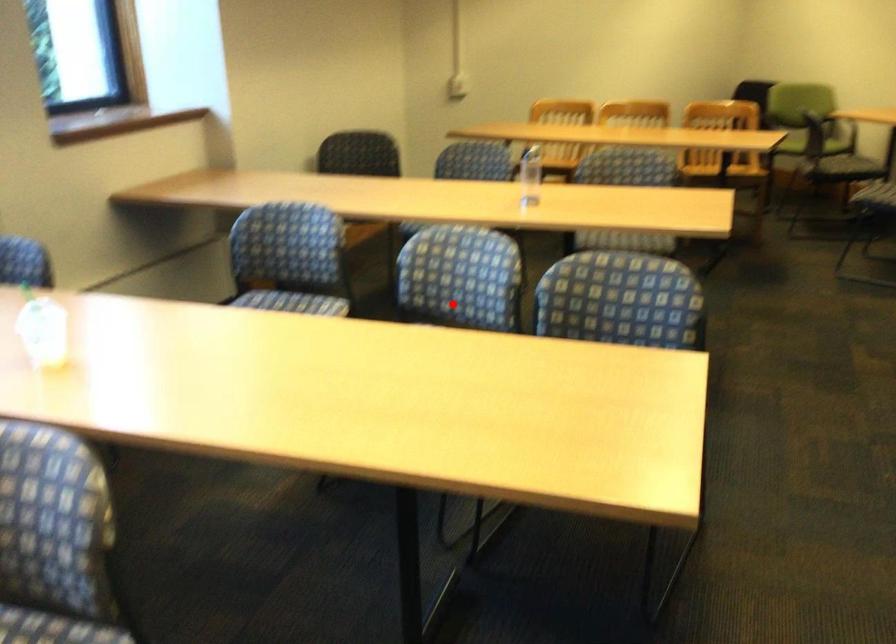
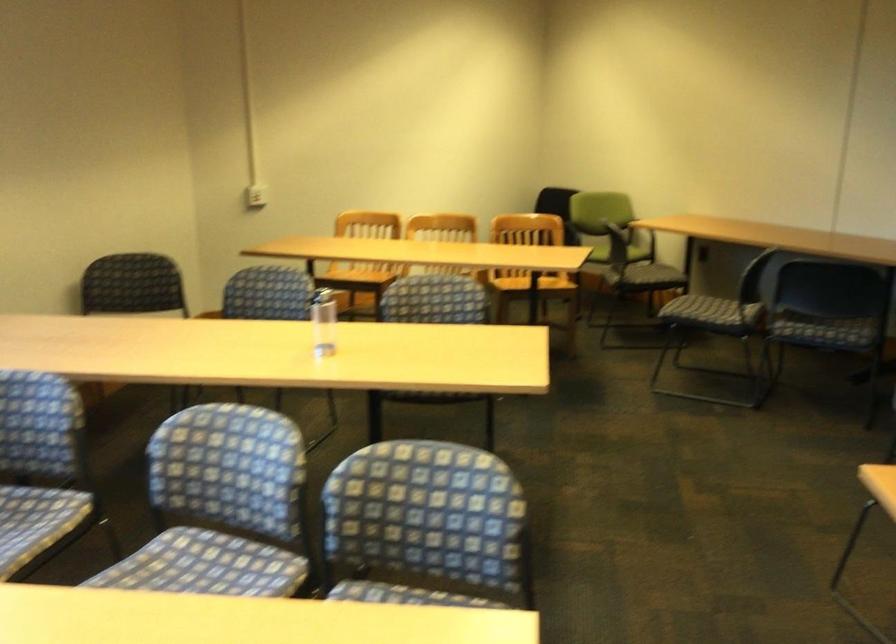
Find the pixel in the second image that matches the highlighted location in the first image.

(221, 506)